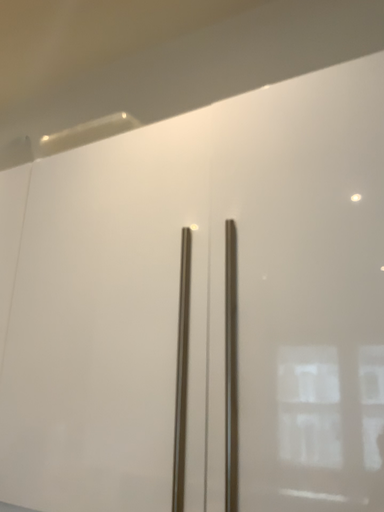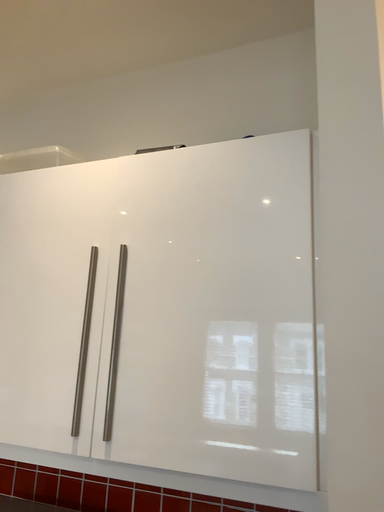
Question: How did the camera likely rotate when shooting the video?

Choices:
 (A) rotated left
 (B) rotated right

Answer: (B)